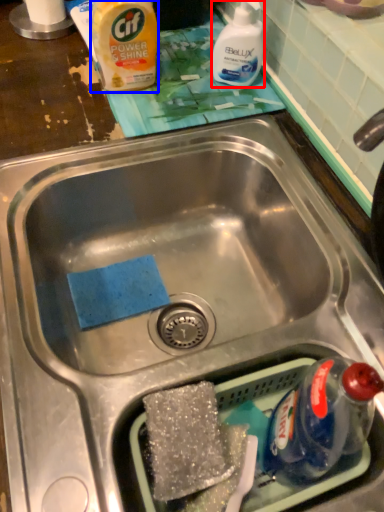
Question: Which object is closer to the camera taking this photo, cleaning product (highlighted by a red box) or product (highlighted by a blue box)?

Choices:
 (A) cleaning product
 (B) product

Answer: (B)